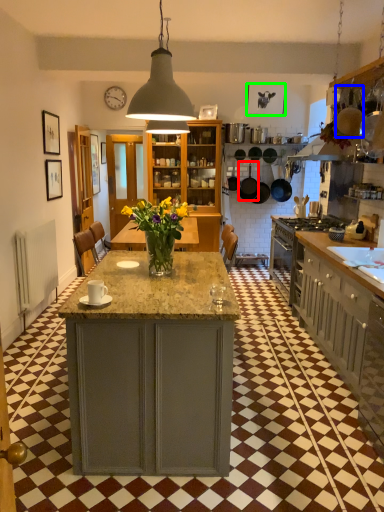
Question: Estimate the real-world distances between objects in this image. Which object is closer to frying pan (highlighted by a red box), frying pan (highlighted by a blue box) or picture frame (highlighted by a green box)?

Choices:
 (A) frying pan
 (B) picture frame

Answer: (B)